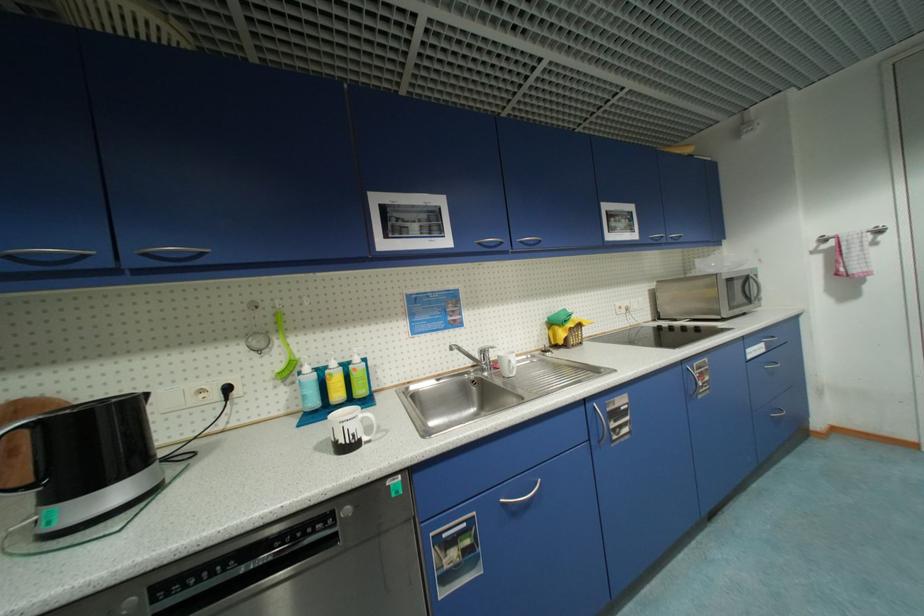
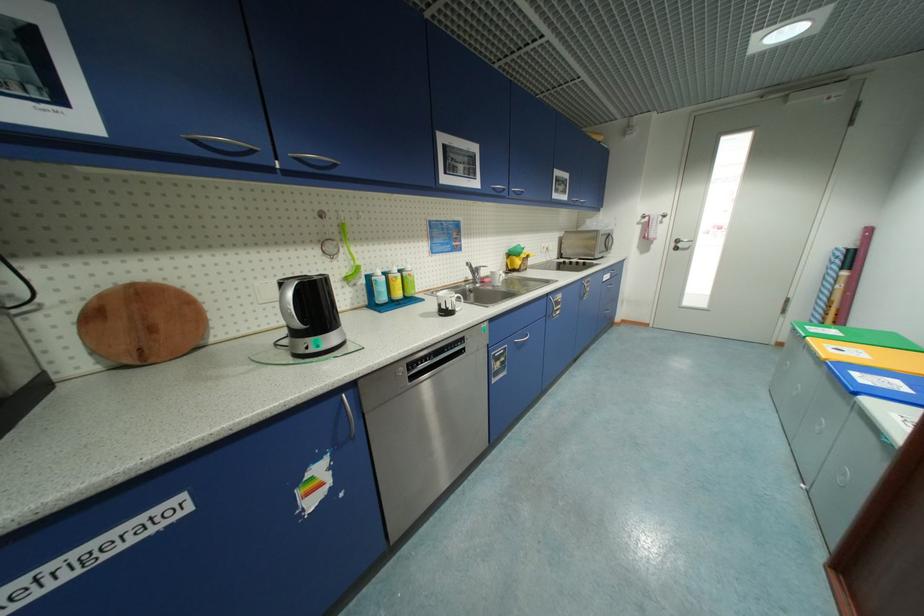
In the second image, find the point that corresponds to (x=512, y=248) in the first image.

(512, 195)